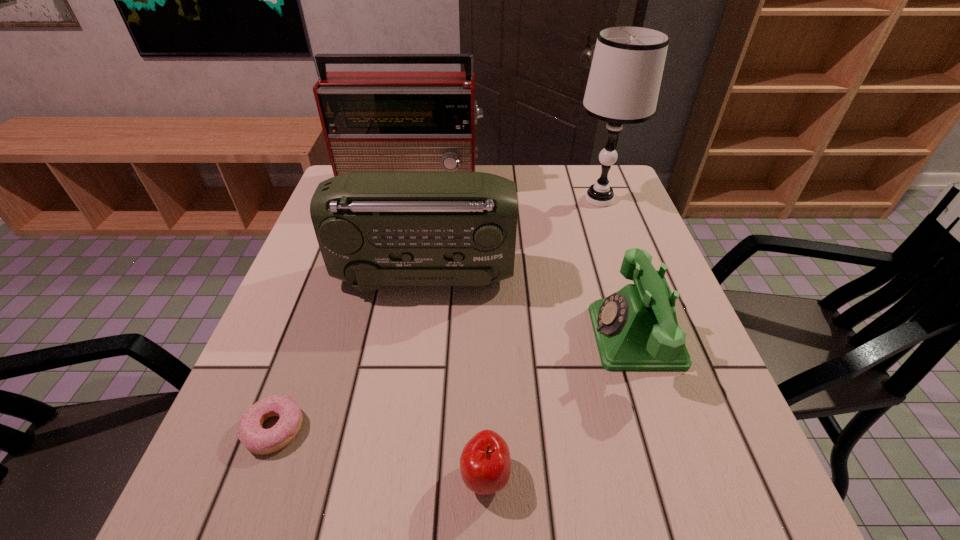
Identify which object is the second closest to the third tallest object. Please provide its 2D coordinates. Your answer should be formatted as a tuple, i.e. [(x, y)], where the tuple contains the x and y coordinates of a point satisfying the conditions above.

[(624, 81)]

Where is `free space that satisfies the following two spatial constraints: 1. on the front-facing side of the second tallest object; 2. on the right side of the apple`? Image resolution: width=960 pixels, height=540 pixels. free space that satisfies the following two spatial constraints: 1. on the front-facing side of the second tallest object; 2. on the right side of the apple is located at coordinates (352, 476).

The width and height of the screenshot is (960, 540). In order to click on vacant space that satisfies the following two spatial constraints: 1. on the back side of the second shortest object; 2. on the front-facing side of the fourth shortest object in this screenshot , I will do `click(484, 276)`.